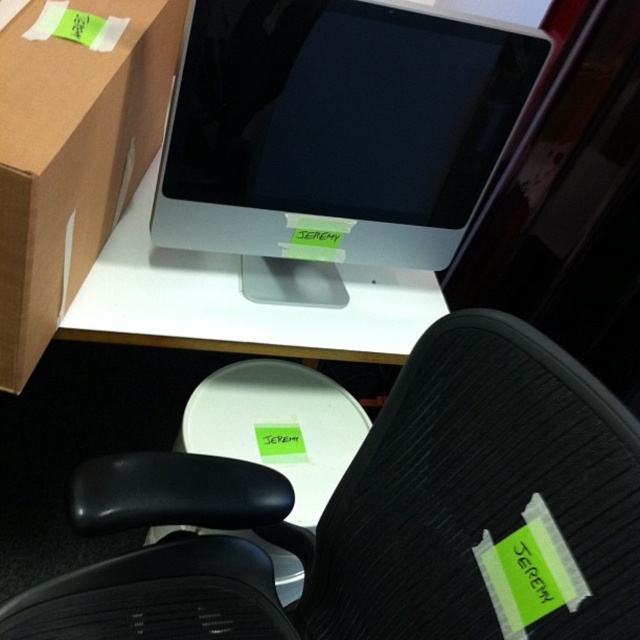
You are organizing a workspace and need to place a large poster on the wall behind the sleek silver monitor at upper center and the white glossy table at center. Which object should you position closer to the wall to ensure the poster can be seen clearly from the entrance?

The sleek silver monitor at upper center is bigger than the white glossy table at center, so positioning the monitor closer to the wall would allow the poster to be seen clearly from the entrance.

You are standing at the center of the workspace and see two points marked in the image. Which point is closer to you, point [346,36] or point [257,342]?

Point [346,36] is in front of point [257,342], so it is closer to you.

You are an office assistant tasked with arranging a meeting. You need to place a 12cm tall nameplate on the tallest object between the black mesh swivel chair at center and the sleek silver monitor at upper center. Which object should you choose?

The black mesh swivel chair at center is taller than the sleek silver monitor at upper center, so you should place the nameplate on the black mesh swivel chair at center.